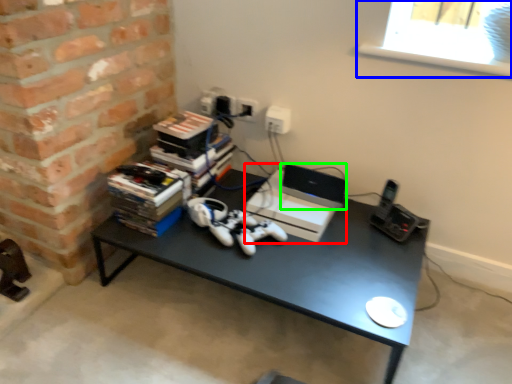
Question: Based on their relative distances, which object is nearer to computer (highlighted by a red box)? Choose from window screen (highlighted by a blue box) and laptop (highlighted by a green box).

Choices:
 (A) window screen
 (B) laptop

Answer: (B)